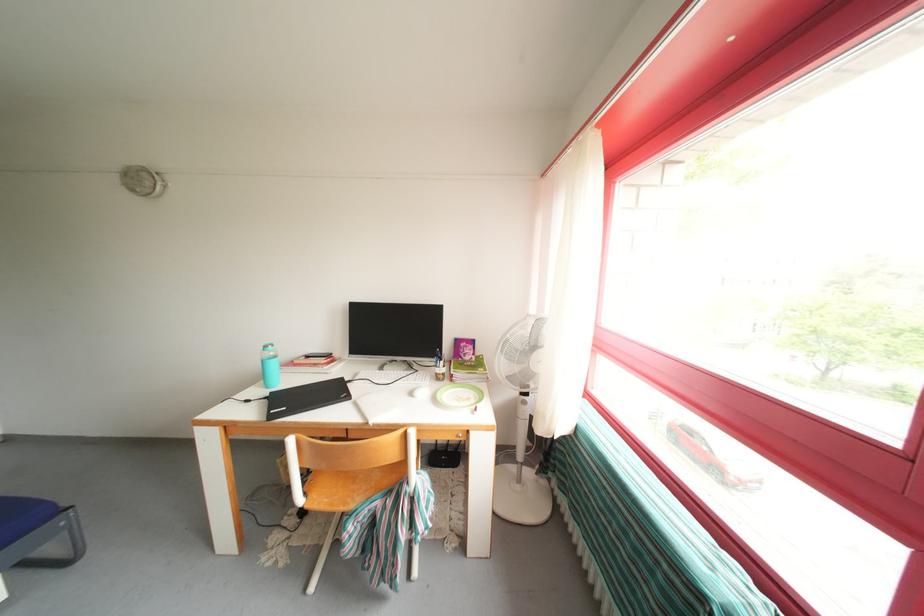
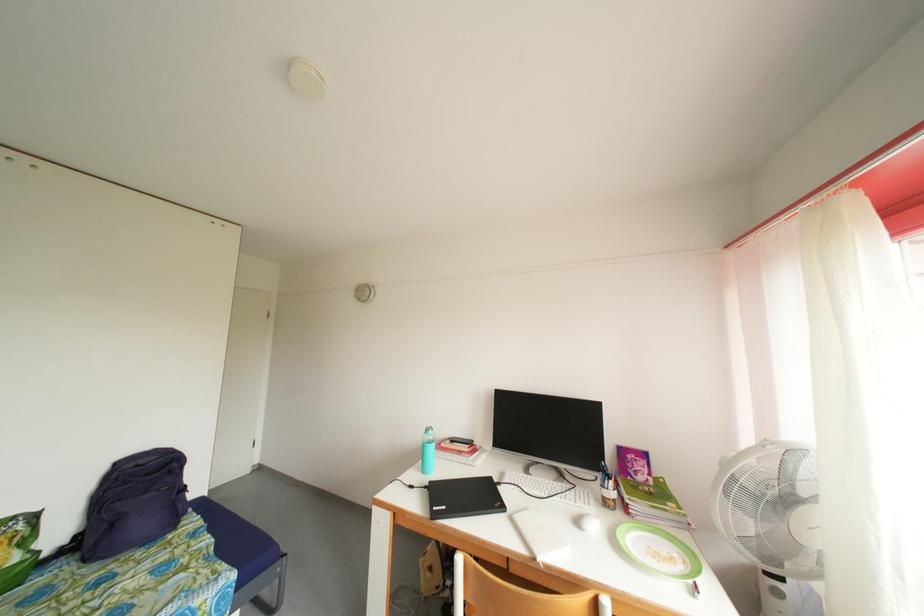
Locate, in the second image, the point that corresponds to point (274, 352) in the first image.

(434, 436)